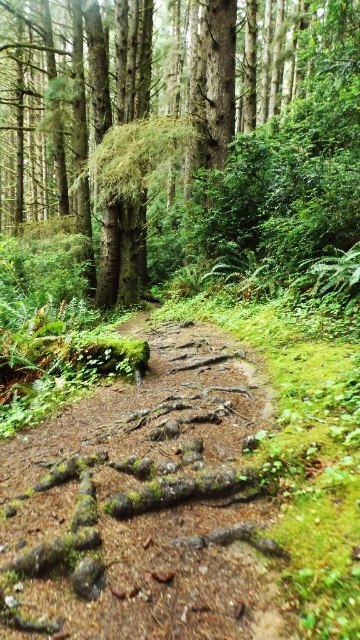
The height and width of the screenshot is (640, 360). Find the location of `green mossy tree at center`. green mossy tree at center is located at coordinates (182, 132).

Who is more forward, (x=268, y=259) or (x=69, y=422)?

Point (x=69, y=422) is in front.

At what (x,y) coordinates should I click in order to perform the action: click on green mossy tree at center. Please return your answer as a coordinate pair (x, y). This screenshot has width=360, height=640. Looking at the image, I should click on tap(182, 132).